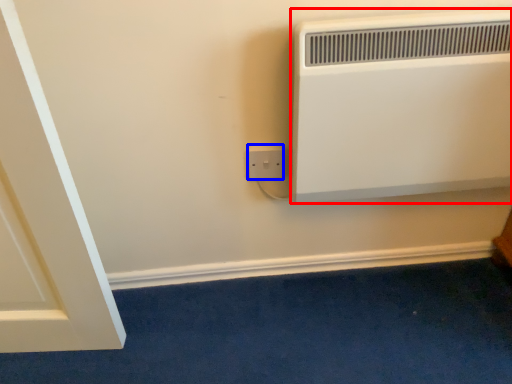
Question: Among these objects, which one is nearest to the camera, heater (highlighted by a red box) or power plugs and sockets (highlighted by a blue box)?

Choices:
 (A) heater
 (B) power plugs and sockets

Answer: (A)